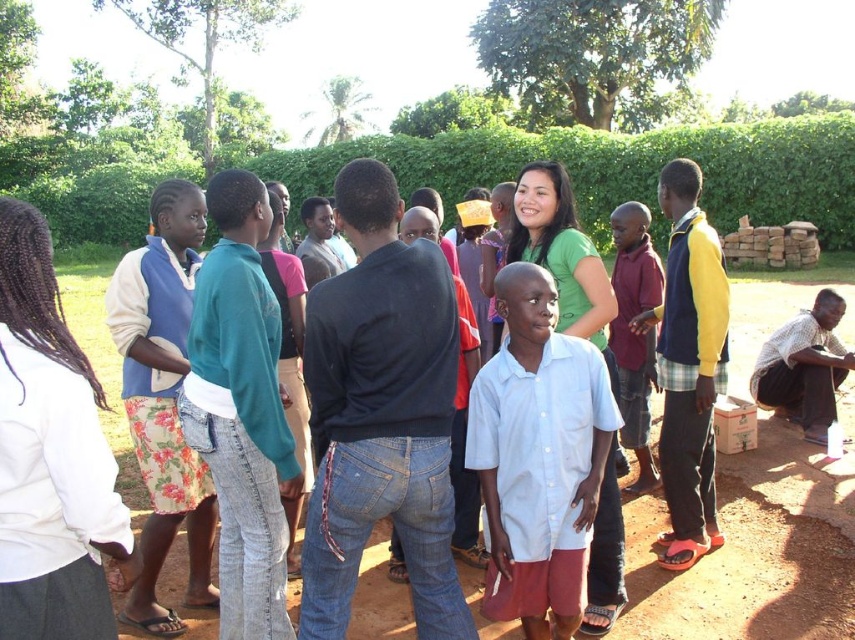
You are attending a community event in a rural area and see a person wearing a white cotton shirt at center and teal denim jeans at center. Which piece of clothing is located to the right?

The white cotton shirt at center is positioned on the right side of the teal denim jeans at center, so the white cotton shirt at center is to the right.

Looking at this image, you are a photographer trying to capture a candid shot of the teal denim jeans at center and the floral skirt at left. If your camera has a maximum focus range of 3 feet, will you be able to include both subjects in a single focused shot?

The distance between the teal denim jeans at center and the floral skirt at left is 3.59 feet, which exceeds the camera maximum focus range of 3 feet. Therefore, you cannot include both subjects in a single focused shot.

You are a photographer trying to capture a candid shot of the white cotton shirt at center and the teal denim jeans at center. Since you want to focus on both subjects equally, which clothing item should you zoom in on more to ensure they appear the same size in the photo?

The white cotton shirt at center has a smaller size compared to teal denim jeans at center. To make them appear the same size in the photo, you should zoom in more on the white cotton shirt at center so it fills the frame appropriately while keeping the teal denim jeans at center at a slightly wider angle.